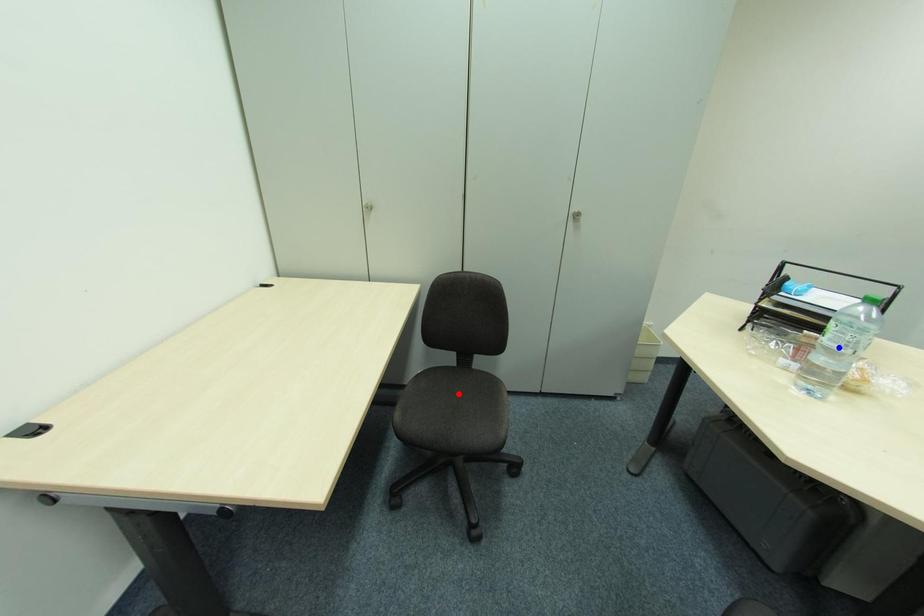
Question: In the image, two points are highlighted. Which point is nearer to the camera? Reply with the corresponding letter.

Choices:
 (A) blue point
 (B) red point

Answer: (A)